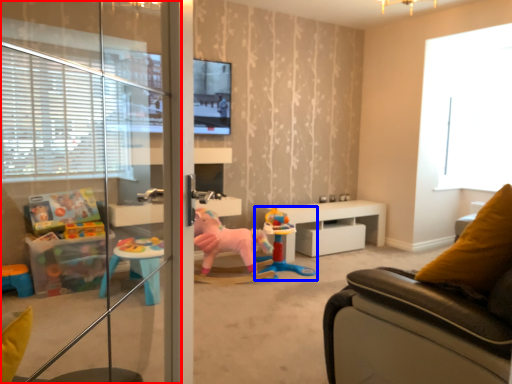
Question: Among these objects, which one is nearest to the camera, screen door (highlighted by a red box) or toy (highlighted by a blue box)?

Choices:
 (A) screen door
 (B) toy

Answer: (A)